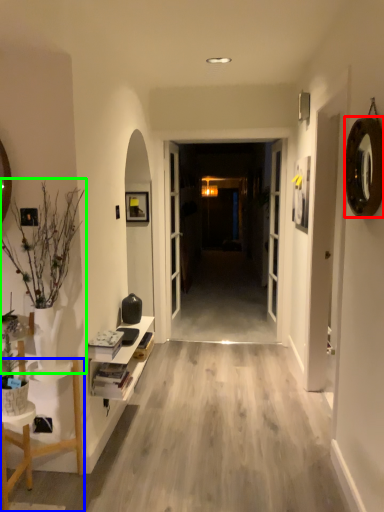
Question: Which is farther away from oval (highlighted by a red box)? furniture (highlighted by a blue box) or houseplant (highlighted by a green box)?

Choices:
 (A) furniture
 (B) houseplant

Answer: (A)